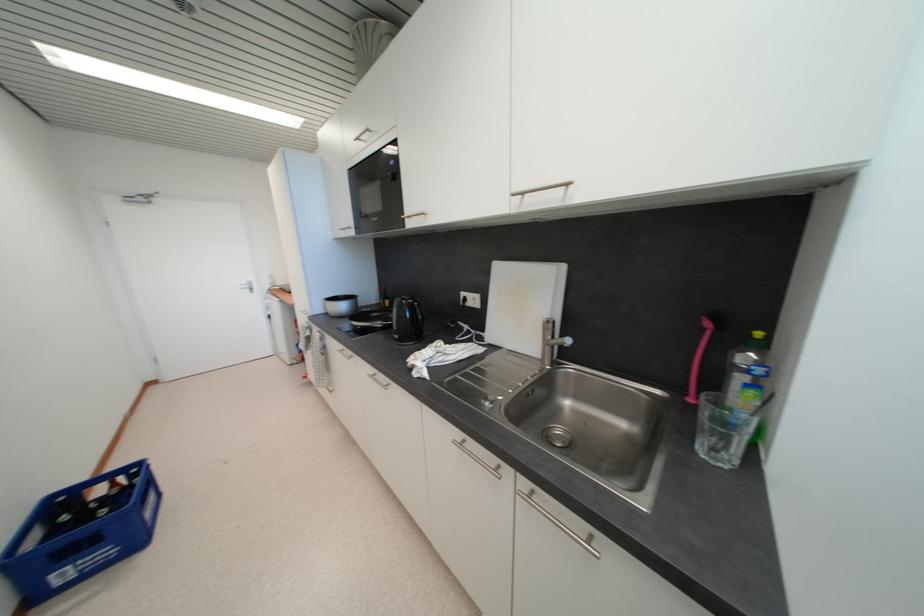
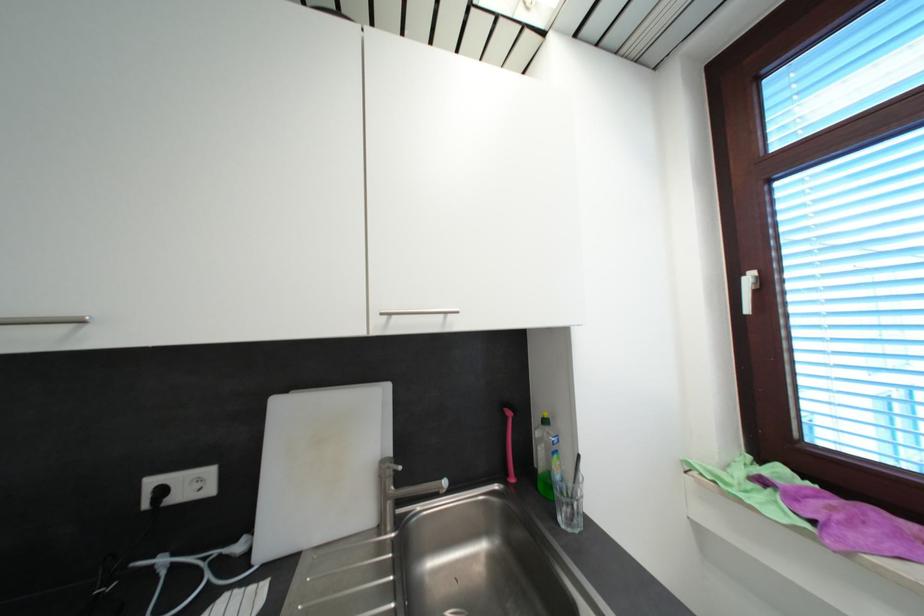
In the second image, find the point that corresponds to (528,196) in the first image.

(395, 315)